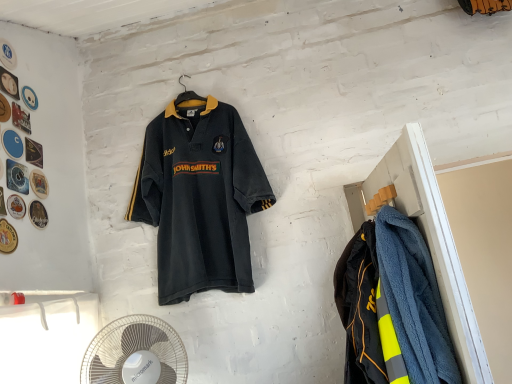
Question: Is the surface of blue fuzzy coat at right in direct contact with white plastic fan at lower left?

Choices:
 (A) no
 (B) yes

Answer: (A)

Question: From a real-world perspective, is blue fuzzy coat at right located beneath white plastic fan at lower left?

Choices:
 (A) no
 (B) yes

Answer: (A)

Question: Is the position of blue fuzzy coat at right more distant than that of white plastic fan at lower left?

Choices:
 (A) yes
 (B) no

Answer: (B)

Question: Considering the relative positions of blue fuzzy coat at right and white plastic fan at lower left in the image provided, is blue fuzzy coat at right to the left of white plastic fan at lower left from the viewer's perspective?

Choices:
 (A) yes
 (B) no

Answer: (B)

Question: Does blue fuzzy coat at right come in front of white plastic fan at lower left?

Choices:
 (A) no
 (B) yes

Answer: (B)

Question: Can you confirm if blue fuzzy coat at right is shorter than white plastic fan at lower left?

Choices:
 (A) no
 (B) yes

Answer: (A)

Question: Can you confirm if white plastic fan at lower left is taller than blue fuzzy coat at right?

Choices:
 (A) no
 (B) yes

Answer: (A)

Question: Is white plastic fan at lower left completely or partially outside of blue fuzzy coat at right?

Choices:
 (A) no
 (B) yes

Answer: (B)

Question: Can you confirm if white plastic fan at lower left is positioned to the right of blue fuzzy coat at right?

Choices:
 (A) no
 (B) yes

Answer: (A)

Question: Is white plastic fan at lower left facing towards blue fuzzy coat at right?

Choices:
 (A) yes
 (B) no

Answer: (B)

Question: Can you confirm if white plastic fan at lower left is positioned to the left of blue fuzzy coat at right?

Choices:
 (A) no
 (B) yes

Answer: (B)

Question: Considering the relative sizes of white plastic fan at lower left and blue fuzzy coat at right in the image provided, is white plastic fan at lower left bigger than blue fuzzy coat at right?

Choices:
 (A) no
 (B) yes

Answer: (A)

Question: Is dark gray jersey at center not near blue fuzzy coat at right?

Choices:
 (A) no
 (B) yes

Answer: (A)